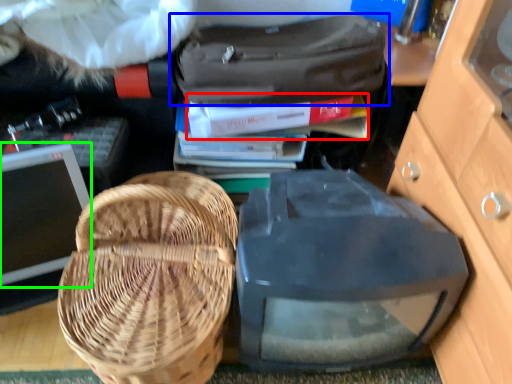
Question: Which object is the farthest from book (highlighted by a red box)? Choose among these: luggage and bags (highlighted by a blue box) or computer monitor (highlighted by a green box).

Choices:
 (A) luggage and bags
 (B) computer monitor

Answer: (B)